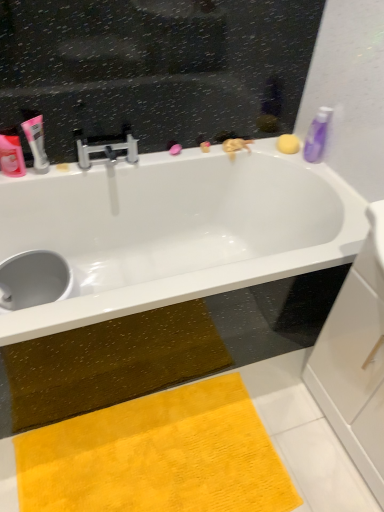
Question: Should I look upward or downward to see matte pink tube at left, which is the 1th toiletry from left to right?

Choices:
 (A) down
 (B) up

Answer: (B)

Question: Can you confirm if matte pink tube at left, which ranks as the third toiletry in right-to-left order, is taller than yellow plush doormat at lower center?

Choices:
 (A) no
 (B) yes

Answer: (B)

Question: From the image's perspective, is matte pink tube at left, which ranks as the third toiletry in right-to-left order, on yellow plush doormat at lower center?

Choices:
 (A) no
 (B) yes

Answer: (B)

Question: Can you confirm if matte pink tube at left, which ranks as the third toiletry in right-to-left order, is smaller than yellow plush doormat at lower center?

Choices:
 (A) yes
 (B) no

Answer: (A)

Question: Is matte pink tube at left, which ranks as the third toiletry in right-to-left order, positioned with its back to yellow plush doormat at lower center?

Choices:
 (A) yes
 (B) no

Answer: (B)

Question: Is matte pink tube at left, which is the 1th toiletry from left to right, at the left side of yellow plush doormat at lower center?

Choices:
 (A) no
 (B) yes

Answer: (B)

Question: From a real-world perspective, is matte pink tube at left, which is the 1th toiletry from left to right, physically above yellow plush doormat at lower center?

Choices:
 (A) no
 (B) yes

Answer: (B)

Question: Considering the relative sizes of purple glossy bottle at upper right, the 1th toiletry when ordered from right to left, and yellow plush doormat at lower center in the image provided, is purple glossy bottle at upper right, the 1th toiletry when ordered from right to left, taller than yellow plush doormat at lower center?

Choices:
 (A) yes
 (B) no

Answer: (A)

Question: From the image's perspective, is purple glossy bottle at upper right, the third toiletry viewed from the left, beneath yellow plush doormat at lower center?

Choices:
 (A) yes
 (B) no

Answer: (B)

Question: Does purple glossy bottle at upper right, the 1th toiletry when ordered from right to left, have a greater width compared to yellow plush doormat at lower center?

Choices:
 (A) yes
 (B) no

Answer: (B)

Question: Considering the relative sizes of purple glossy bottle at upper right, the third toiletry viewed from the left, and yellow plush doormat at lower center in the image provided, is purple glossy bottle at upper right, the third toiletry viewed from the left, shorter than yellow plush doormat at lower center?

Choices:
 (A) yes
 (B) no

Answer: (B)

Question: Can you confirm if purple glossy bottle at upper right, the third toiletry viewed from the left, is bigger than yellow plush doormat at lower center?

Choices:
 (A) yes
 (B) no

Answer: (B)

Question: Is the surface of purple glossy bottle at upper right, the 1th toiletry when ordered from right to left, in direct contact with yellow plush doormat at lower center?

Choices:
 (A) yes
 (B) no

Answer: (B)

Question: Can you confirm if white glossy bathtub at upper center is thinner than purple glossy bottle at upper right, the 1th toiletry when ordered from right to left?

Choices:
 (A) no
 (B) yes

Answer: (A)